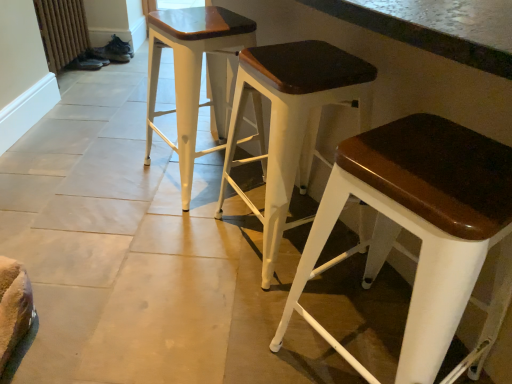
Question: Relative to rustic wood radiator at lower left, is white wood stool at center, the 3th stool in the right-to-left sequence, in front or behind?

Choices:
 (A) front
 (B) behind

Answer: (A)

Question: Is white wood stool at center, the first stool when ordered from left to right, spatially inside rustic wood radiator at lower left, or outside of it?

Choices:
 (A) outside
 (B) inside

Answer: (A)

Question: Which is nearer to the rustic wood radiator at lower left?

Choices:
 (A) white wood stool at center, the 3th stool in the left-to-right sequence
 (B) matte white stool at center, which is the second stool from left to right
 (C) white wood stool at center, the 3th stool in the right-to-left sequence

Answer: (C)

Question: Which is farther from the rustic wood radiator at lower left?

Choices:
 (A) matte white stool at center, acting as the 2th stool starting from the right
 (B) white wood stool at center, the 3th stool in the right-to-left sequence
 (C) white wood stool at center, the first stool viewed from the right

Answer: (C)